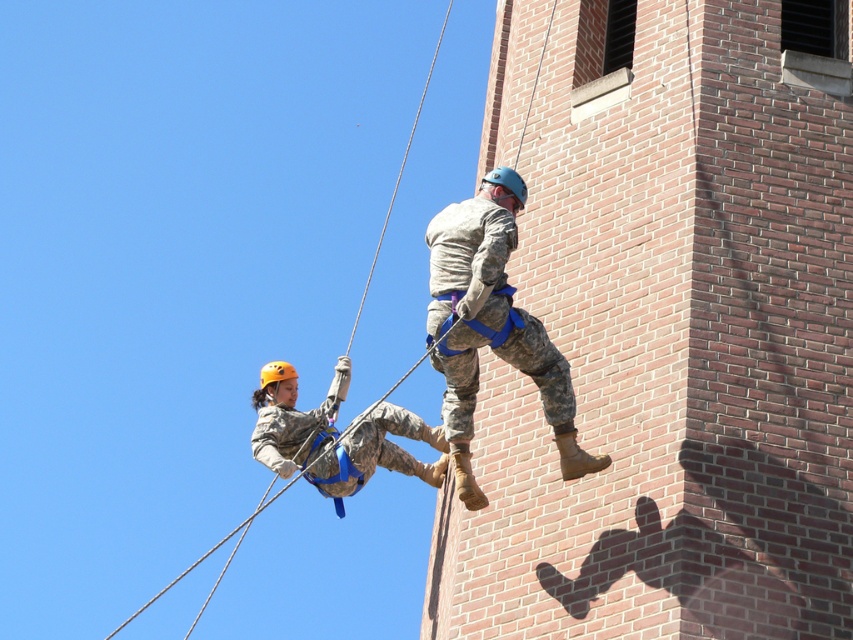
You are a drone operator trying to capture a photo of the rappelling individuals. The camera can focus on objects within 30 meters. Is the point at coordinates point [488,230] within the camera focus range?

The point at coordinates point [488,230] is 30.11 meters from the camera, which is slightly beyond the 30 meters focus range. Therefore, it may not be in focus.

You are a safety inspector assessing the rappelling setup. You notice the camouflage fabric helmet at center and the rope at upper left. Which object is positioned lower in the image?

The camouflage fabric helmet at center has a lesser height compared to the rope at upper left, so the camouflage fabric helmet at center is positioned lower in the image.

You are a drone operator trying to capture a photo of the two rappelling individuals. You need to ensure that both points are visible in the frame. Given that point 1 is at coordinates point (503, 220) and point 2 is at point (381, 228), which point is closer to the camera based on their spatial relationship?

Point (503, 220) is in front of point (381, 228), so it is closer to the camera.